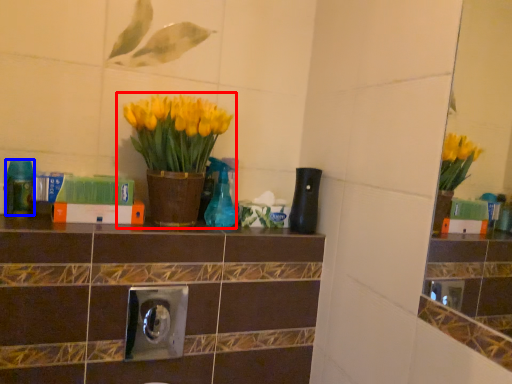
Question: Which point is closer to the camera, houseplant (highlighted by a red box) or bottle (highlighted by a blue box)?

Choices:
 (A) houseplant
 (B) bottle

Answer: (A)